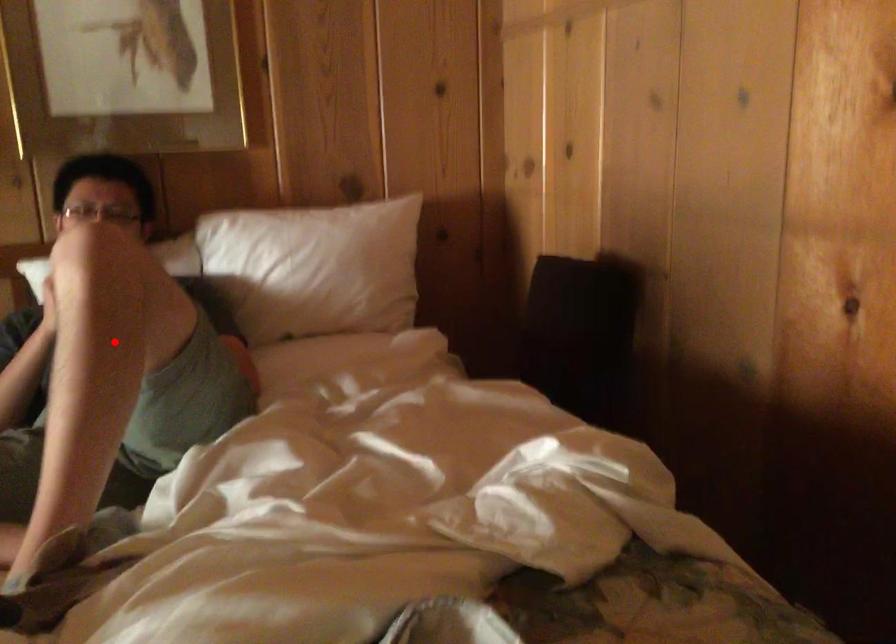
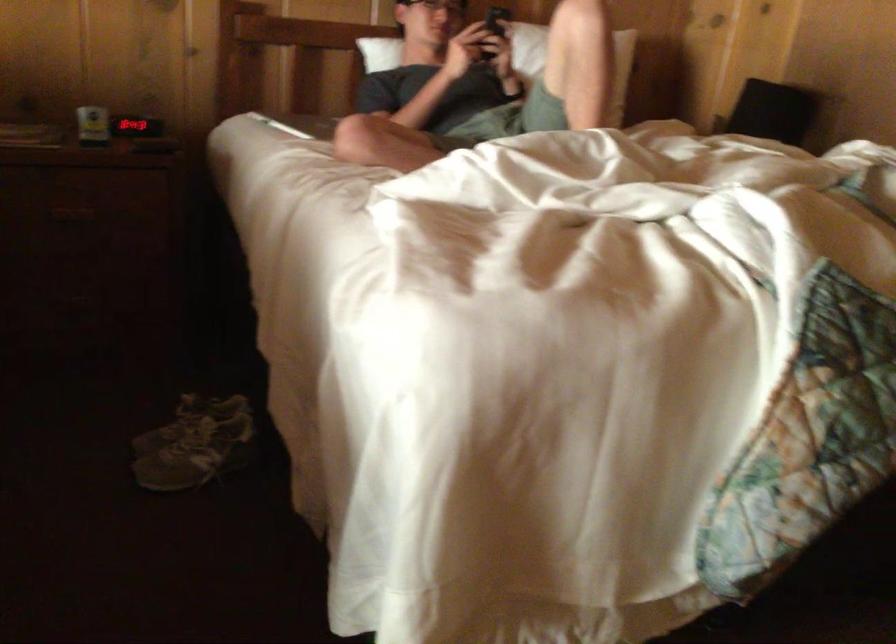
The point at the highlighted location is marked in the first image. Where is the corresponding point in the second image?

(573, 61)